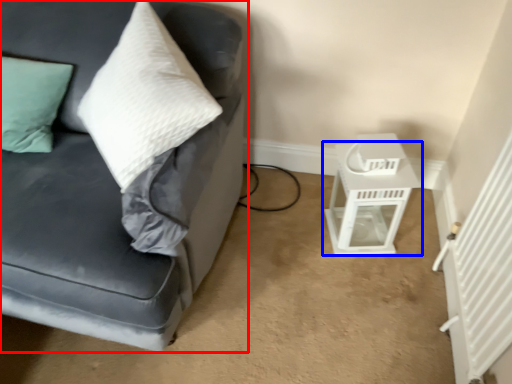
Question: Which object appears closest to the camera in this image, studio couch (highlighted by a red box) or table (highlighted by a blue box)?

Choices:
 (A) studio couch
 (B) table

Answer: (A)